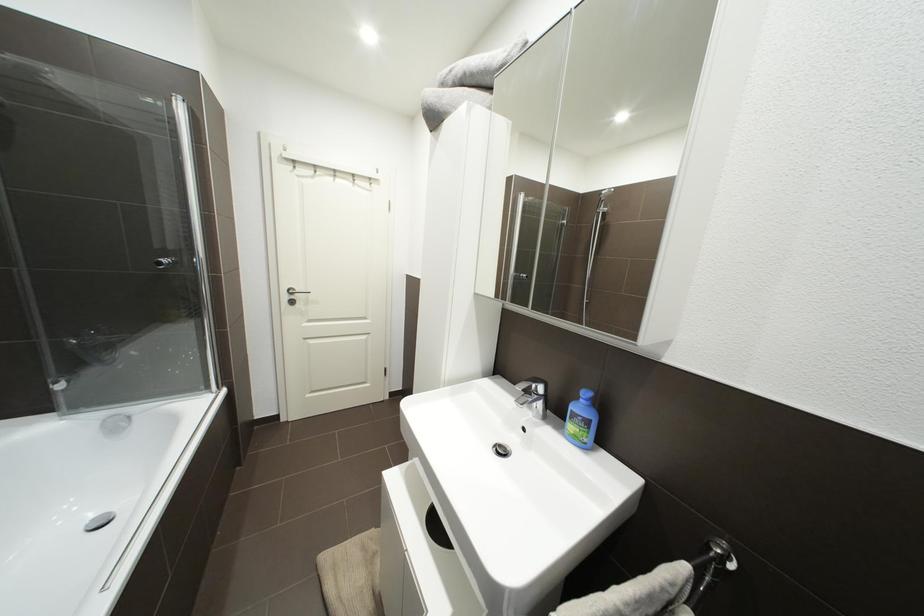
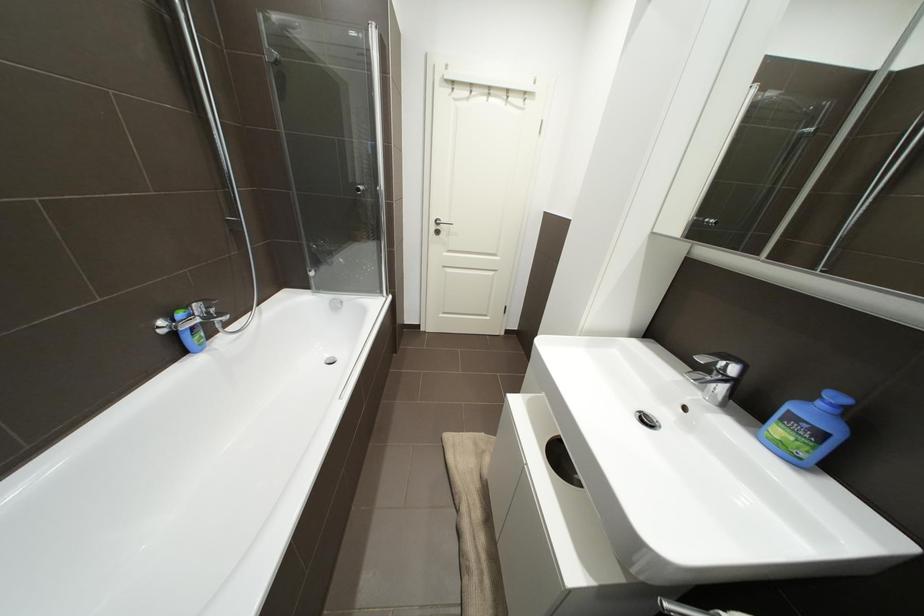
Question: The images are taken continuously from a first-person perspective. In which direction is your viewpoint rotating?

Choices:
 (A) Left
 (B) Right
 (C) Up
 (D) Down

Answer: (A)